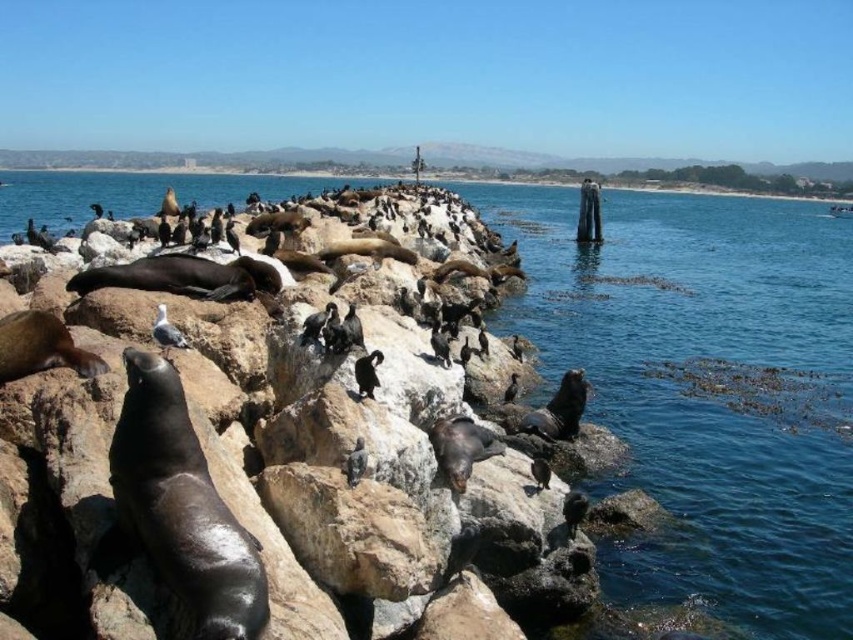
Question: Which of the following is the closest to the observer?

Choices:
 (A) clear blue water at center
 (B) smooth rock at center

Answer: (B)

Question: Does clear blue water at center appear on the left side of smooth rock at center?

Choices:
 (A) no
 (B) yes

Answer: (A)

Question: Is clear blue water at center wider than smooth rock at center?

Choices:
 (A) no
 (B) yes

Answer: (A)

Question: Which point is closer to the camera taking this photo?

Choices:
 (A) (605, 365)
 (B) (102, 292)

Answer: (B)

Question: Does clear blue water at center have a greater width compared to smooth rock at center?

Choices:
 (A) yes
 (B) no

Answer: (B)